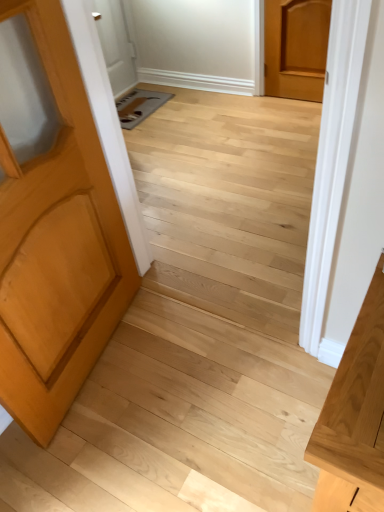
Question: From their relative heights in the image, would you say light brown wood door at upper right, arranged as the first door when viewed from the top, is taller or shorter than light brown wood door at left, positioned as the second door in back-to-front order?

Choices:
 (A) tall
 (B) short

Answer: (B)

Question: In the image, is light brown wood door at upper right, marked as the second door in a bottom-to-top arrangement, on the left side or the right side of light brown wood door at left, the 2th door positioned from the top?

Choices:
 (A) left
 (B) right

Answer: (B)

Question: Estimate the real-world distances between objects in this image. Which object is farther from the light brown wood door at upper right, marked as the second door in a bottom-to-top arrangement?

Choices:
 (A) light wood vanity at right
 (B) light brown wood door at left, positioned as the second door in back-to-front order

Answer: (A)

Question: Which object is positioned closest to the light wood vanity at right?

Choices:
 (A) light brown wood door at left, the 2th door positioned from the top
 (B) light brown wood door at upper right, marked as the second door in a bottom-to-top arrangement

Answer: (A)